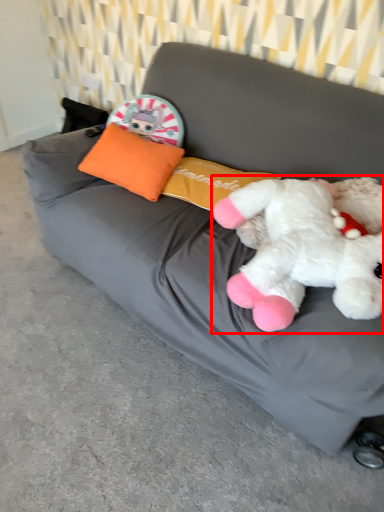
Question: From the image's perspective, what is the correct spatial relationship of toy (annotated by the red box) in relation to pillow?

Choices:
 (A) below
 (B) above

Answer: (A)